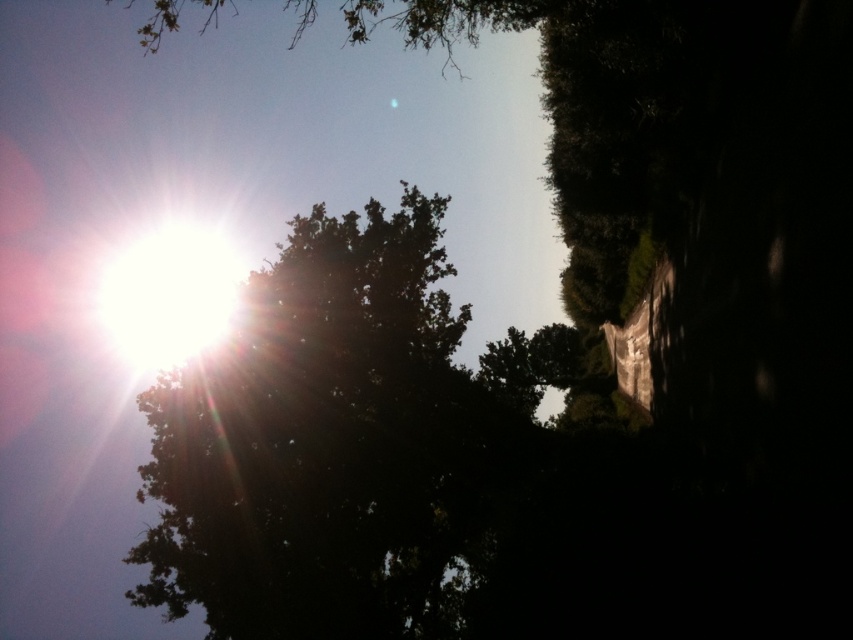
Question: From the image, what is the correct spatial relationship of bright white sun at upper left in relation to green leafy tree at upper center?

Choices:
 (A) left
 (B) right

Answer: (A)

Question: Does dark green leafy tree at upper center appear over green leafy tree at upper center?

Choices:
 (A) yes
 (B) no

Answer: (B)

Question: Among these points, which one is farthest from the camera?

Choices:
 (A) (177, 276)
 (B) (207, 480)
 (C) (155, 40)

Answer: (C)

Question: Among these points, which one is nearest to the camera?

Choices:
 (A) (134, 250)
 (B) (231, 621)
 (C) (490, 19)

Answer: (C)

Question: Among these objects, which one is farthest from the camera?

Choices:
 (A) green leafy tree at upper center
 (B) dark green leafy tree at upper center
 (C) bright white sun at upper left

Answer: (C)

Question: Is bright white sun at upper left behind green leafy tree at upper center?

Choices:
 (A) yes
 (B) no

Answer: (A)